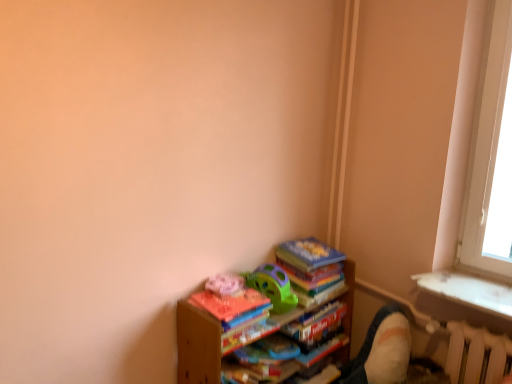
In order to face wooden books at lower right, should I rotate leftwards or rightwards?

It's best to rotate right around 2.471 degrees.

You are a GUI agent. You are given a task and a screenshot of the screen. Output one action in this format:
    pyautogui.click(x=<x>, y=<y>)
    Task: Click on the white plastic radiator at lower right
    This screenshot has width=512, height=384.
    Given the screenshot: What is the action you would take?
    pyautogui.click(x=476, y=354)

Where is `wooden books at lower right`? This screenshot has height=384, width=512. wooden books at lower right is located at coordinates (203, 344).

Between white plastic radiator at lower right and velvet beige swivel chair at lower right, which one appears on the left side from the viewer's perspective?

A: velvet beige swivel chair at lower right is more to the left.

Does point (448, 350) lie behind point (377, 347)?

No, it is in front of (377, 347).

From a real-world perspective, which is physically below, white plastic radiator at lower right or velvet beige swivel chair at lower right?

velvet beige swivel chair at lower right is physically lower.

From the picture: Based on their positions, is velvet beige swivel chair at lower right located to the left or right of green plastic toy at center?

velvet beige swivel chair at lower right is positioned on green plastic toy at center's right side.

Which object is more forward, velvet beige swivel chair at lower right or green plastic toy at center?

green plastic toy at center is more forward.

Is point (375, 373) closer or farther from the camera than point (282, 312)?

Point (375, 373).

From a real-world perspective, is wooden books at lower right on velvet beige swivel chair at lower right?

Yes, from a real-world perspective, wooden books at lower right is over velvet beige swivel chair at lower right

Is velvet beige swivel chair at lower right located within wooden books at lower right?

No, velvet beige swivel chair at lower right is located outside of wooden books at lower right.

Could you tell me if wooden books at lower right is facing velvet beige swivel chair at lower right?

Yes, wooden books at lower right faces towards velvet beige swivel chair at lower right.

You are a GUI agent. You are given a task and a screenshot of the screen. Output one action in this format:
    pyautogui.click(x=<x>, y=<y>)
    Task: Click on the shelf above the velvet beige swivel chair at lower right (from the image's perspective)
    Image resolution: width=512 pixels, height=384 pixels.
    Given the screenshot: What is the action you would take?
    pyautogui.click(x=203, y=344)

Is white plastic radiator at lower right touching wooden books at lower right?

No, white plastic radiator at lower right is not making contact with wooden books at lower right.

From the image's perspective, which one is positioned lower, white plastic radiator at lower right or wooden books at lower right?

wooden books at lower right is shown below in the image.

Locate an element on the screen. Image resolution: width=512 pixels, height=384 pixels. shelf beneath the white plastic radiator at lower right (from a real-world perspective) is located at coordinates (203, 344).

Is wooden books at lower right far from white plastic radiator at lower right?

They are positioned close to each other.

This screenshot has width=512, height=384. I want to click on shelf on the left of white plastic radiator at lower right, so click(203, 344).

Consider the image. Does wooden books at lower right contain white plastic radiator at lower right?

No, white plastic radiator at lower right is not surrounded by wooden books at lower right.

Which object is more forward, wooden books at lower right or white plastic radiator at lower right?

wooden books at lower right is more forward.

Is wooden books at lower right oriented towards hardcover book at lower center?

Yes, wooden books at lower right is aimed at hardcover book at lower center.

Which is closer to the camera, (353, 279) or (328, 330)?

The point (328, 330) is closer.

Considering the relative sizes of wooden books at lower right and hardcover book at lower center in the image provided, is wooden books at lower right thinner than hardcover book at lower center?

No, wooden books at lower right is not thinner than hardcover book at lower center.

Does wooden books at lower right have a lesser height compared to hardcover book at lower center?

Incorrect, the height of wooden books at lower right does not fall short of that of hardcover book at lower center.

Would you consider hardcover book at lower center to be distant from white plastic radiator at lower right?

hardcover book at lower center is actually quite close to white plastic radiator at lower right.

Considering the relative positions of hardcover book at lower center and white plastic radiator at lower right in the image provided, is hardcover book at lower center to the right of white plastic radiator at lower right from the viewer's perspective?

Incorrect, hardcover book at lower center is not on the right side of white plastic radiator at lower right.

From a real-world perspective, which is physically above, hardcover book at lower center or white plastic radiator at lower right?

In real-world perspective, white plastic radiator at lower right is above.

This screenshot has height=384, width=512. I want to click on radiator on the right of the hardcover book at lower center, so click(476, 354).

Identify the location of radiator on the right of velvet beige swivel chair at lower right. The image size is (512, 384). (476, 354).

Find the location of a particular element. The image size is (512, 384). toy above the velvet beige swivel chair at lower right (from the image's perspective) is located at coordinates tap(272, 286).

Based on their spatial positions, is green plastic toy at center or hardcover book at lower center closer to wooden books at lower right?

Based on the image, green plastic toy at center appears to be nearer to wooden books at lower right.

Looking at the image, which one is located closer to wooden books at lower right, white plastic radiator at lower right or hardcover book at lower center?

hardcover book at lower center.

Considering their positions, is hardcover book at lower center positioned further to green plastic toy at center than wooden books at lower right?

hardcover book at lower center.

From the picture: Looking at the image, which one is located further to hardcover book at lower center, velvet beige swivel chair at lower right or wooden books at lower right?

velvet beige swivel chair at lower right is further to hardcover book at lower center.

From the image, which object appears to be farther from hardcover book at lower center, wooden books at lower right or velvet beige swivel chair at lower right?

The object further to hardcover book at lower center is velvet beige swivel chair at lower right.

Looking at this image, based on their spatial positions, is hardcover book at lower center or green plastic toy at center closer to wooden books at lower right?

The object closer to wooden books at lower right is green plastic toy at center.

When comparing their distances from white plastic radiator at lower right, does green plastic toy at center or wooden books at lower right seem further?

wooden books at lower right is positioned further to the anchor white plastic radiator at lower right.

Considering their positions, is wooden books at lower right positioned further to green plastic toy at center than velvet beige swivel chair at lower right?

velvet beige swivel chair at lower right.

Where is `paperback book located between wooden books at lower right and white plastic radiator at lower right in the left-right direction`? This screenshot has width=512, height=384. paperback book located between wooden books at lower right and white plastic radiator at lower right in the left-right direction is located at coordinates (316, 324).

Where is `shelf located between green plastic toy at center and white plastic radiator at lower right in the left-right direction`? Image resolution: width=512 pixels, height=384 pixels. shelf located between green plastic toy at center and white plastic radiator at lower right in the left-right direction is located at coordinates (203, 344).

Identify the location of swivel chair between wooden books at lower right and white plastic radiator at lower right from left to right. (382, 350).

Find the location of a particular element. The image size is (512, 384). shelf situated between green plastic toy at center and velvet beige swivel chair at lower right from left to right is located at coordinates (203, 344).